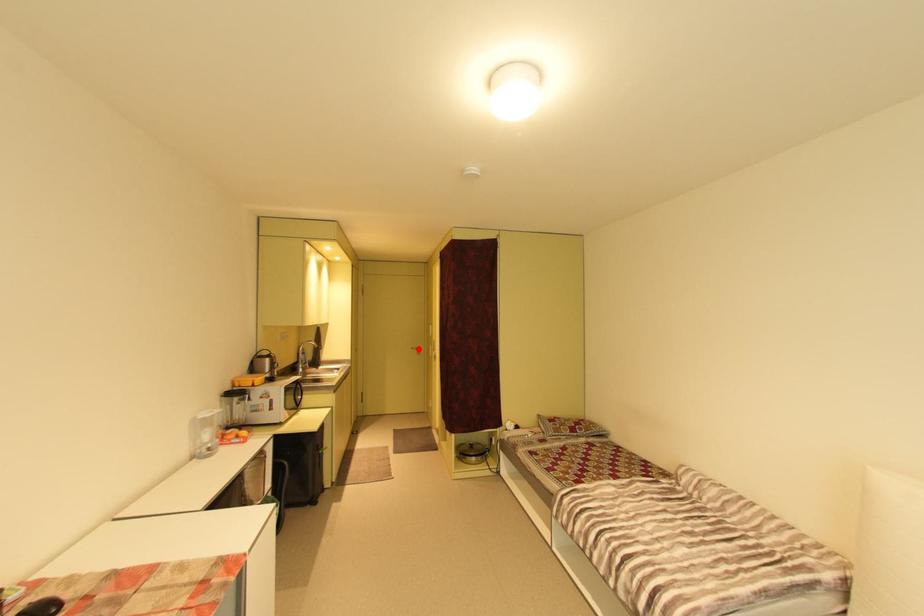
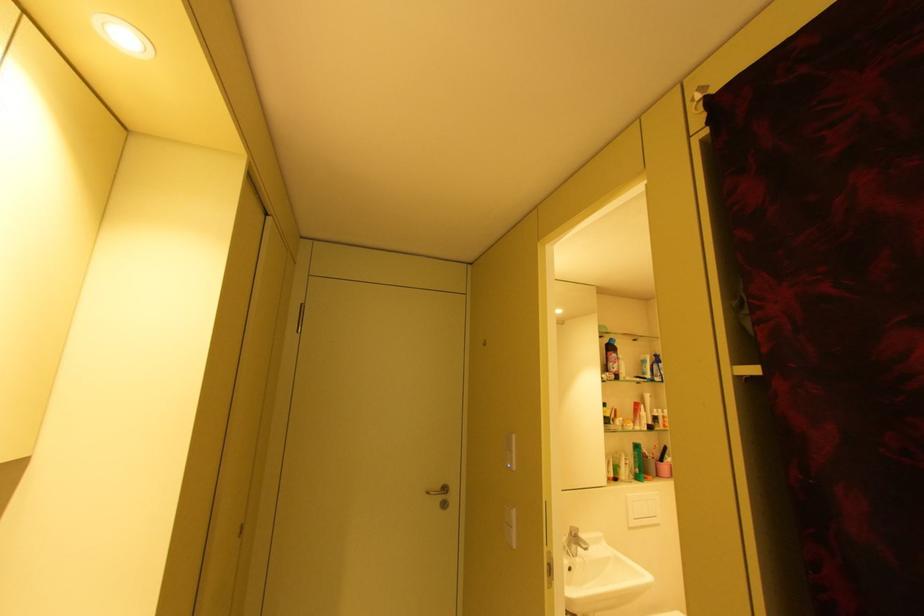
Question: I am providing you with two images of the same scene from different viewpoints. In image1, a red point is highlighted. Considering the same 3D point in image2, which of the following is correct?

Choices:
 (A) It is closer
 (B) It is farther

Answer: (A)